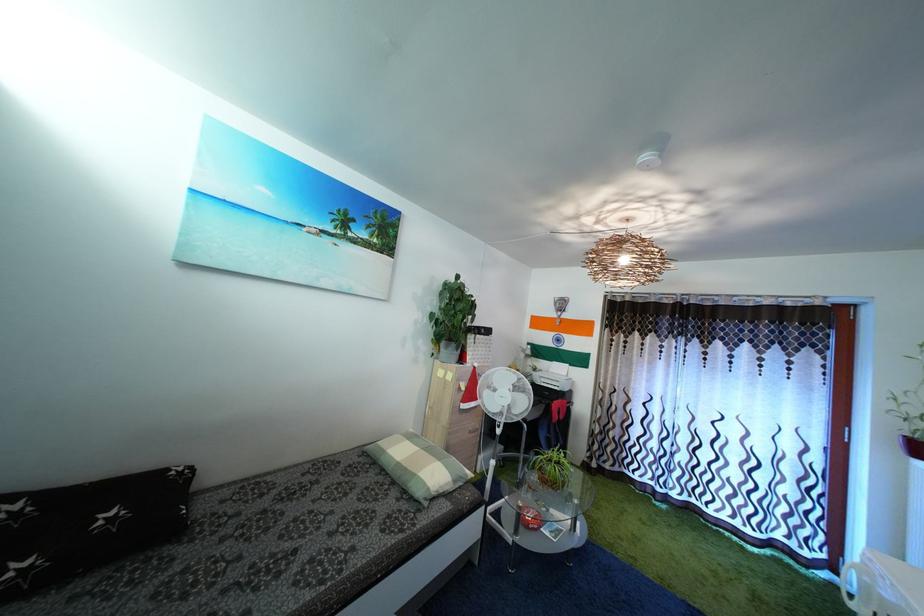
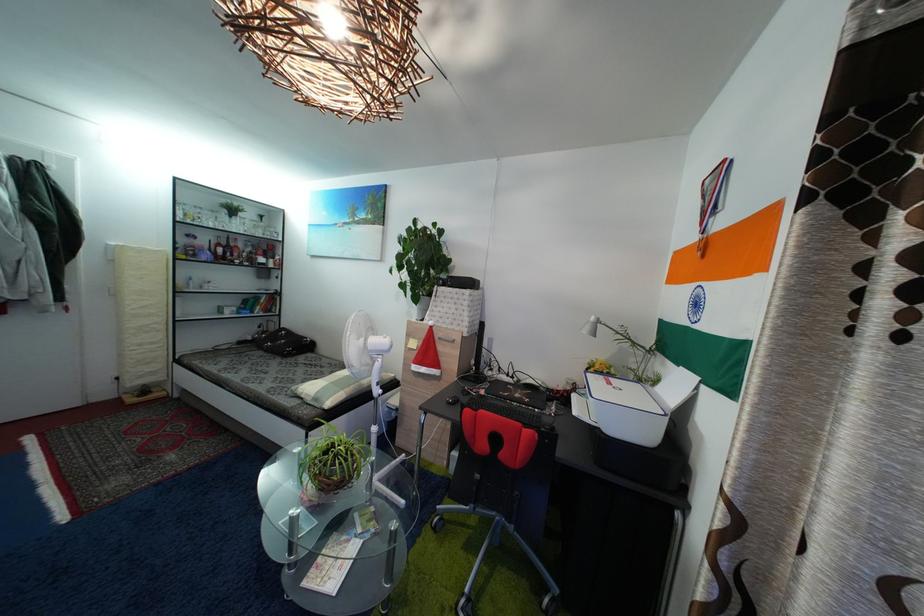
The point at (477, 365) is marked in the first image. Where is the corresponding point in the second image?

(435, 321)